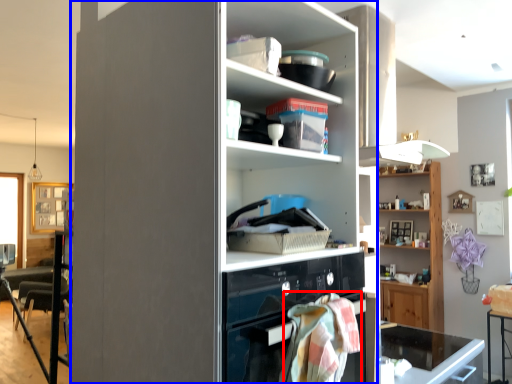
Question: Among these objects, which one is farthest to the camera, blanket (highlighted by a red box) or cupboard (highlighted by a blue box)?

Choices:
 (A) blanket
 (B) cupboard

Answer: (A)